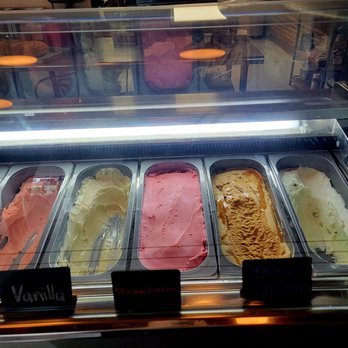
Find the location of a particular element. This screenshot has width=348, height=348. glass of display case to protect ice cream is located at coordinates (217, 270), (214, 220), (204, 137), (199, 66).